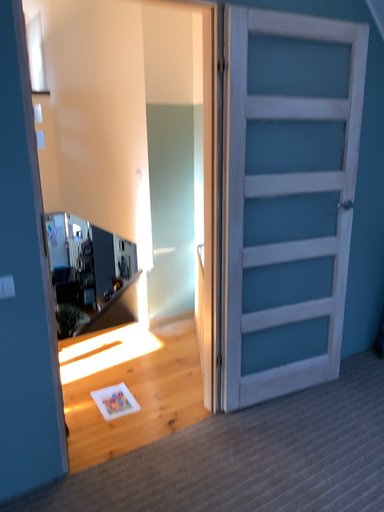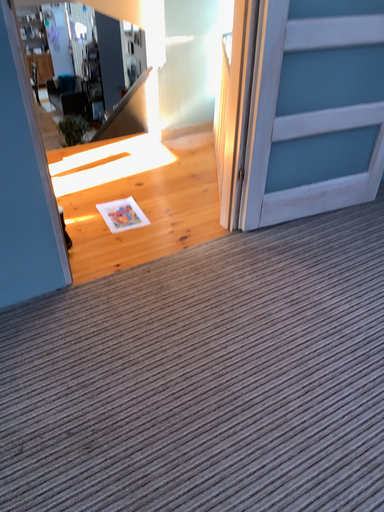
Question: How did the camera likely rotate when shooting the video?

Choices:
 (A) rotated upward
 (B) rotated downward

Answer: (B)